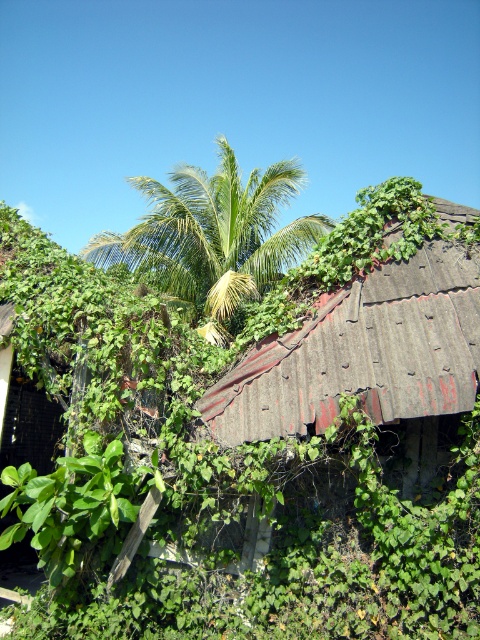
Question: Is rusty corrugated metal roof at center to the left of green leafy palm tree at center from the viewer's perspective?

Choices:
 (A) yes
 (B) no

Answer: (B)

Question: Is rusty corrugated metal roof at center wider than green leafy palm tree at center?

Choices:
 (A) no
 (B) yes

Answer: (A)

Question: Which point is closer to the camera?

Choices:
 (A) (x=222, y=317)
 (B) (x=349, y=385)

Answer: (B)

Question: Considering the relative positions of rusty corrugated metal roof at center and green leafy palm tree at center in the image provided, where is rusty corrugated metal roof at center located with respect to green leafy palm tree at center?

Choices:
 (A) above
 (B) below

Answer: (B)